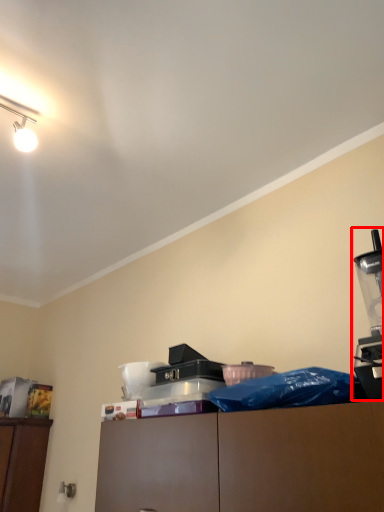
Question: In this image, where is coffee machine (annotated by the red box) located relative to job?

Choices:
 (A) right
 (B) left

Answer: (A)